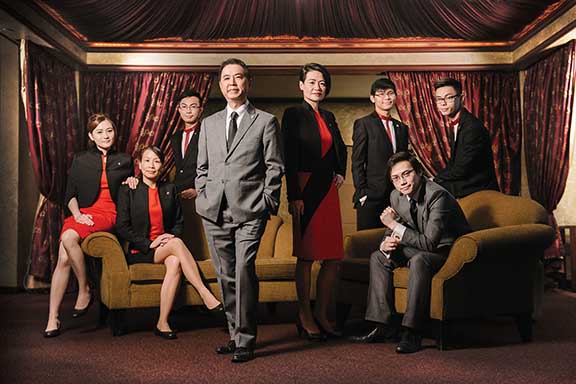
Identify the location of cushion. (270, 235).